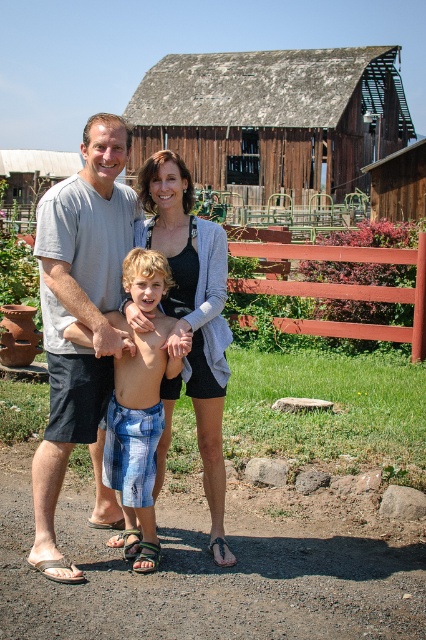
You are a photographer trying to capture a photo of the weathered wood barn at upper center and the multicolored fabric sandal at lower center. Which object should you zoom in on to make them appear the same size in the photo?

You should zoom in on the weathered wood barn at upper center because it is larger in size compared to the multicolored fabric sandal at lower center, so zooming in on it will help balance their sizes in the photo.

You are standing in front of the barn and want to take a photo of the two points marked in the image. Which point, point [193,388] or point [23,154], will appear larger in your camera view?

Point [193,388] is closer to the camera than point [23,154], so it will appear larger in the camera view.

Looking at this image, you are a photographer trying to capture the family in front of the barn. You want to focus on the person wearing the matte gray sweater at center. Where should you aim your camera to ensure the sweater is in the center of the photo?

You should aim your camera at the coordinates point (x=189, y=285) to ensure the matte gray sweater at center is in the center of the photo.